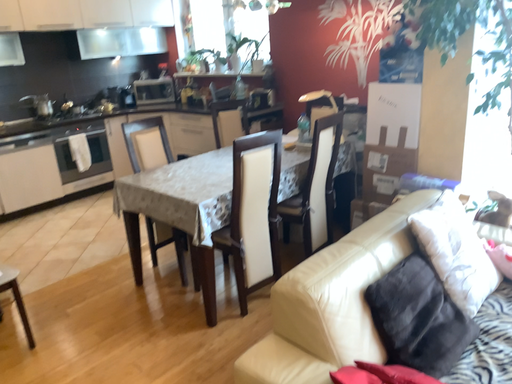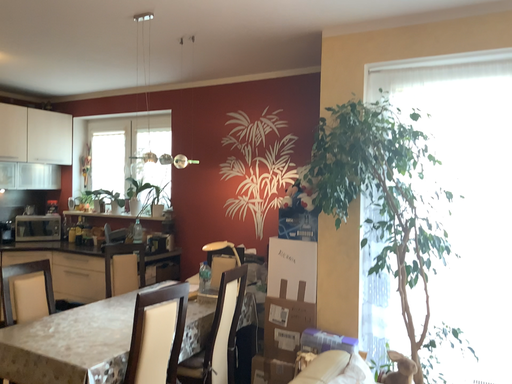
Question: Which way did the camera rotate in the video?

Choices:
 (A) rotated upward
 (B) rotated downward

Answer: (A)